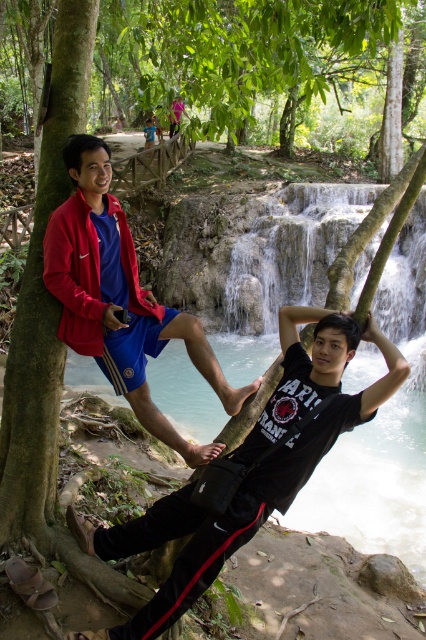
You are standing at the edge of the waterfall and want to hand a waterproof map to the person wearing the black matte shirt at center and the matte blue shorts at left. Which one should you approach first based on their positions?

You should approach the black matte shirt at center first because it is closer to you than the matte blue shorts at left.

You are standing at the waterfall and want to reach the point marked as point (253, 433). If your walking speed is 3 feet per second, how many seconds will it take you to reach that point?

The distance between you and point (253, 433) is 9.63 feet. At a speed of 3 feet per second, it would take 3.21 seconds to reach the point.